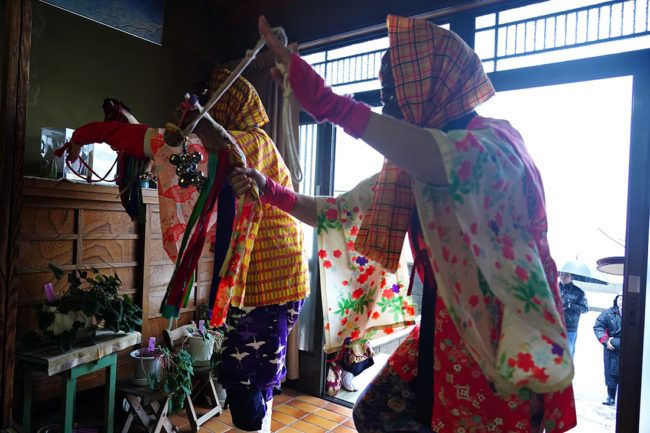
Locate an element on the screen. wall is located at coordinates (65, 72).